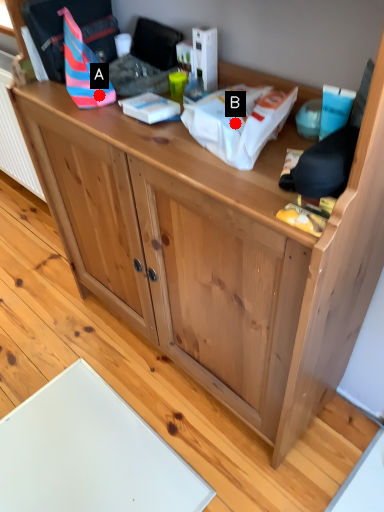
Question: Two points are circled on the image, labeled by A and B beside each circle. Among these points, which one is farthest from the camera?

Choices:
 (A) A is further
 (B) B is further

Answer: (A)